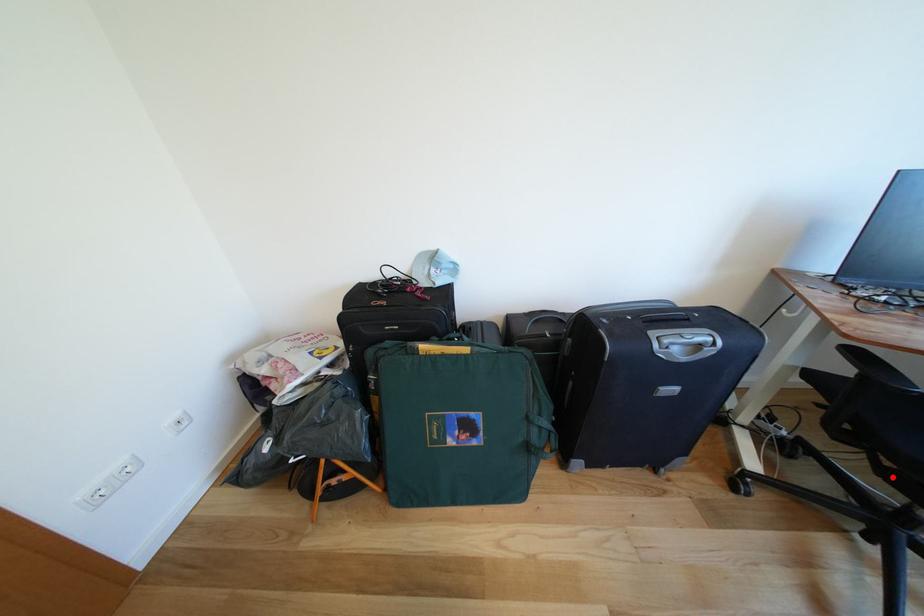
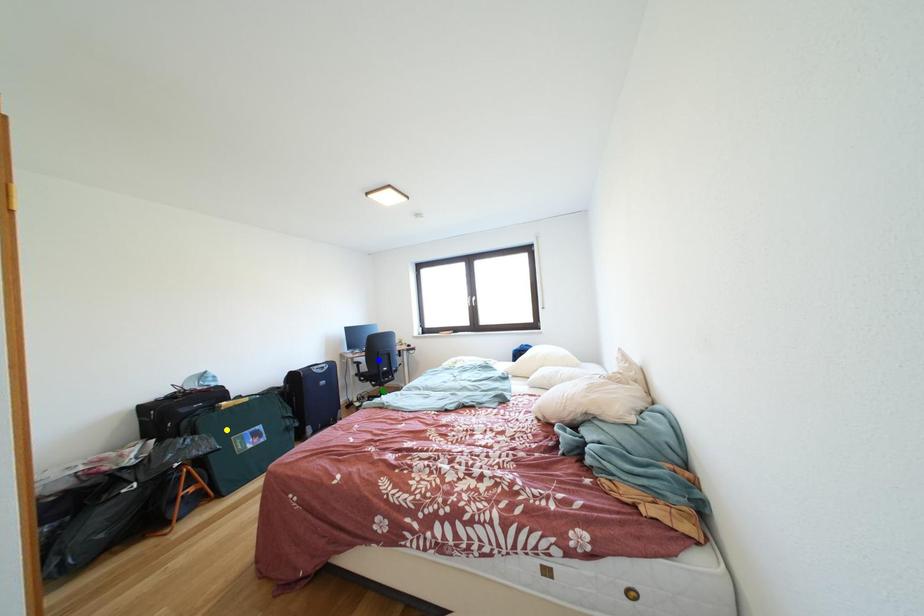
Question: I am providing you with two images of the same scene from different viewpoints. A red point is marked on the first image. You are given multiple points on the second image. Which point in image 2 is actually the same real-world point as the red point in image 1?

Choices:
 (A) yellow point
 (B) blue point
 (C) green point

Answer: (C)